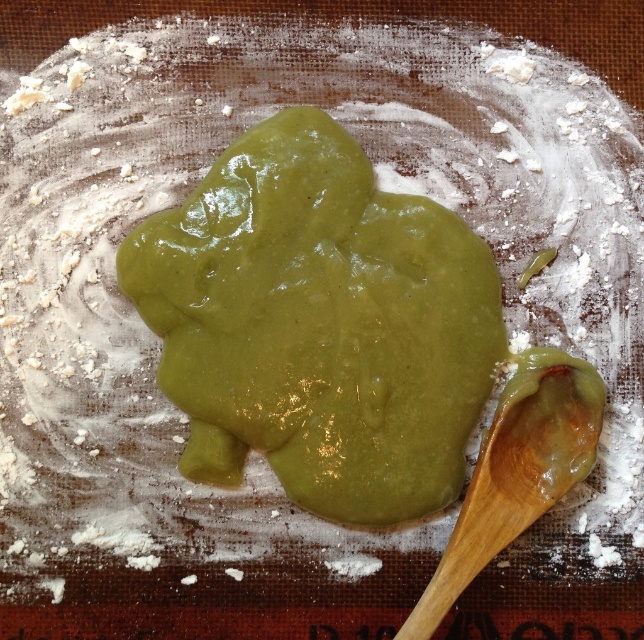
You are a baker preparing to shape the green glossy paste at center. You need to place the wooden spoon at lower right somewhere relative to the paste. Where should you put it?

The wooden spoon at lower right should be placed below the green glossy paste at center since the paste is above the spoon.

You are a chef preparing a dessert and you have a green glossy paste at center and a wooden spoon at lower right. Which object is higher in height?

The green glossy paste at center is taller than the wooden spoon at lower right.